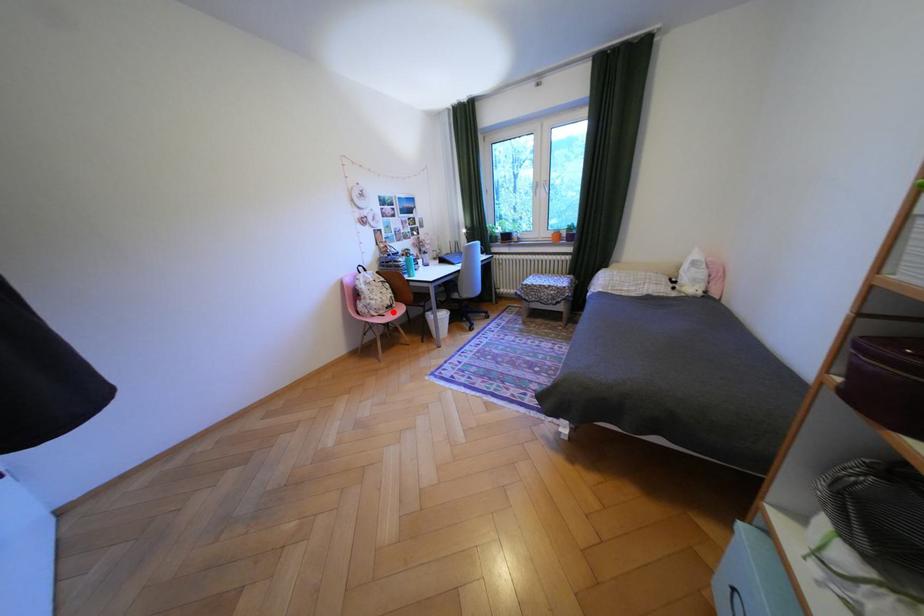
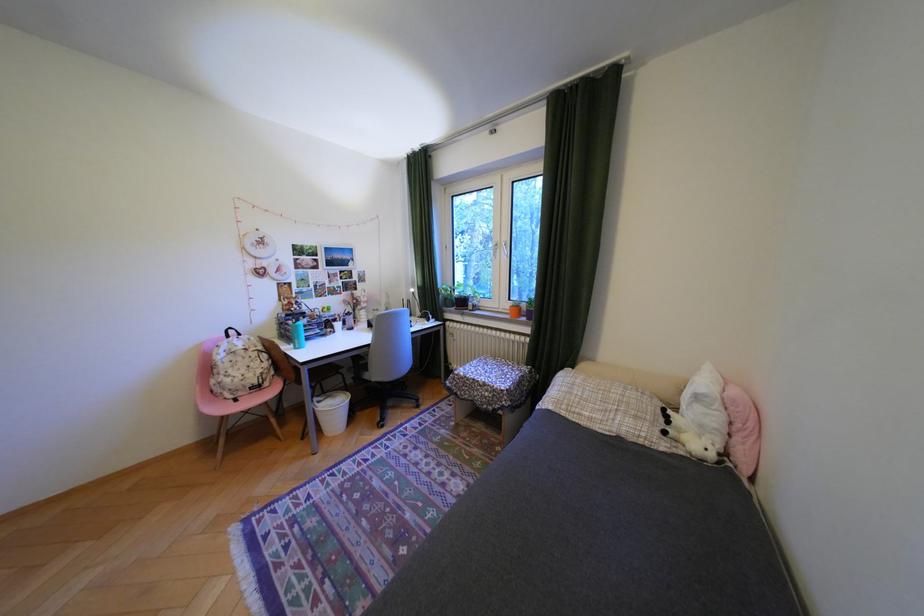
Question: I am providing you with two images of the same scene from different viewpoints. Given a red point in image1, look at the same physical point in image2. Is it:

Choices:
 (A) Closer to the viewpoint
 (B) Farther from the viewpoint

Answer: (B)